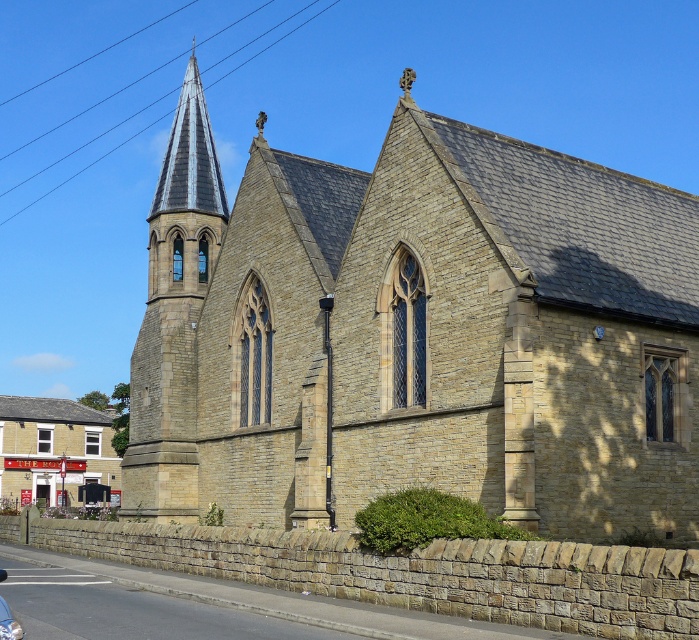
Question: Is the position of gray slate spire at upper left less distant than that of light brown stone pub at lower left?

Choices:
 (A) no
 (B) yes

Answer: (B)

Question: Estimate the real-world distances between objects in this image. Which object is closer to the stone church at center?

Choices:
 (A) light brown stone pub at lower left
 (B) gray slate spire at upper left

Answer: (B)

Question: Which point is closer to the camera taking this photo?

Choices:
 (A) (189, 212)
 (B) (15, 627)
 (C) (28, 424)

Answer: (B)

Question: Does gray slate spire at upper left appear on the right side of shiny silver car at lower left?

Choices:
 (A) no
 (B) yes

Answer: (A)

Question: Which point is farther to the camera?

Choices:
 (A) stone church at center
 (B) gray slate spire at upper left
 (C) shiny silver car at lower left

Answer: (B)

Question: Can you confirm if stone church at center is positioned above light brown stone pub at lower left?

Choices:
 (A) no
 (B) yes

Answer: (B)